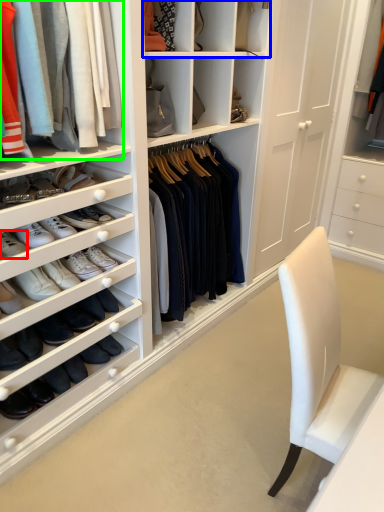
Question: Which object is positioned closest to footwear (highlighted by a red box)? Select from shelf (highlighted by a blue box) and clothing (highlighted by a green box).

Choices:
 (A) shelf
 (B) clothing

Answer: (B)